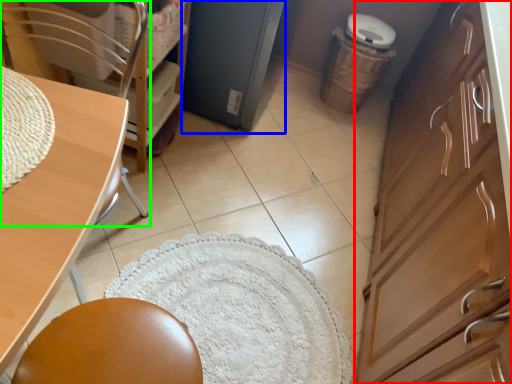
Question: Which is nearer to the cabinetry (highlighted by a red box)? screen door (highlighted by a blue box) or chair (highlighted by a green box).

Choices:
 (A) screen door
 (B) chair

Answer: (A)